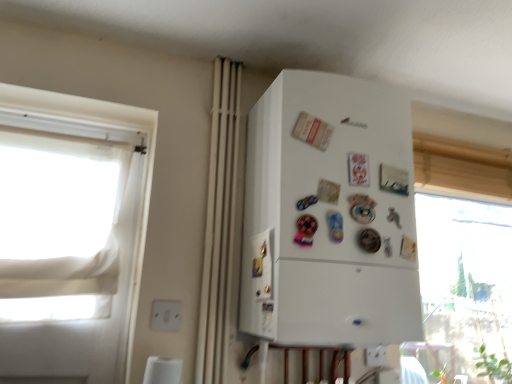
Question: Which direction should I rotate to look at white plastic electric outlet at lower center, the 2th electric outlet in the left-to-right sequence, — up or down?

Choices:
 (A) up
 (B) down

Answer: (B)

Question: Does white matte curtain at center have a larger size compared to white matte refrigerator at center?

Choices:
 (A) no
 (B) yes

Answer: (A)

Question: Can you confirm if white matte curtain at center is wider than white matte refrigerator at center?

Choices:
 (A) yes
 (B) no

Answer: (B)

Question: Is white matte curtain at center smaller than white matte refrigerator at center?

Choices:
 (A) no
 (B) yes

Answer: (B)

Question: Can you confirm if white matte curtain at center is thinner than white matte refrigerator at center?

Choices:
 (A) yes
 (B) no

Answer: (A)

Question: Could white matte refrigerator at center be considered to be inside white matte curtain at center?

Choices:
 (A) no
 (B) yes

Answer: (A)

Question: Is white matte curtain at center aimed at white matte refrigerator at center?

Choices:
 (A) no
 (B) yes

Answer: (A)

Question: Is white matte refrigerator at center further to camera compared to white matte curtain at center?

Choices:
 (A) yes
 (B) no

Answer: (B)

Question: Does white matte refrigerator at center appear on the left side of white matte curtain at center?

Choices:
 (A) yes
 (B) no

Answer: (B)

Question: Is white matte refrigerator at center oriented towards white matte curtain at center?

Choices:
 (A) no
 (B) yes

Answer: (A)

Question: Would you say white matte curtain at center is part of white matte refrigerator at center's contents?

Choices:
 (A) no
 (B) yes

Answer: (A)

Question: Does white matte refrigerator at center have a greater height compared to white matte curtain at center?

Choices:
 (A) yes
 (B) no

Answer: (B)

Question: From the image's perspective, would you say white matte refrigerator at center is shown under white matte curtain at center?

Choices:
 (A) no
 (B) yes

Answer: (B)

Question: Does white plastic electric outlet at lower center, which is counted as the 1th electric outlet, starting from the right, have a smaller size compared to white fabric window at left?

Choices:
 (A) no
 (B) yes

Answer: (B)